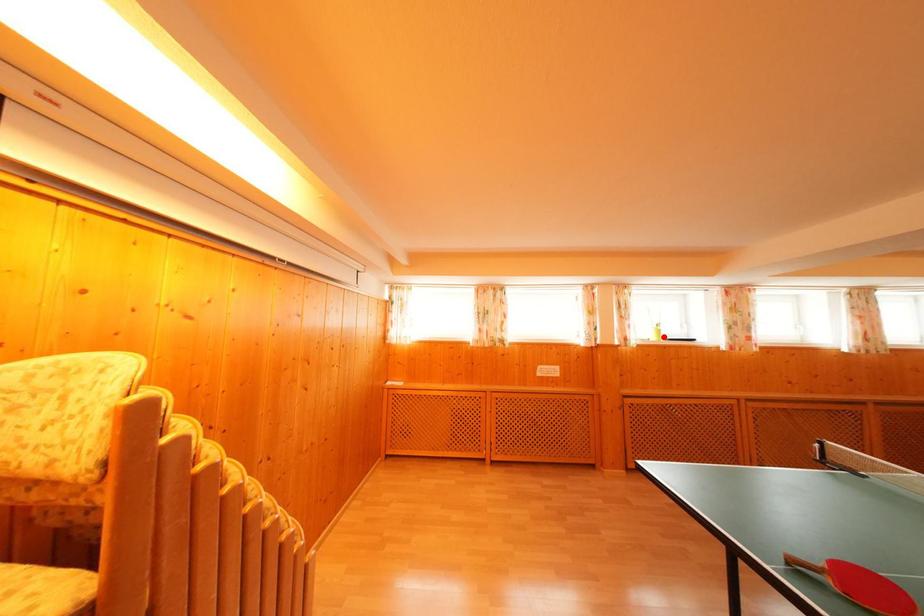
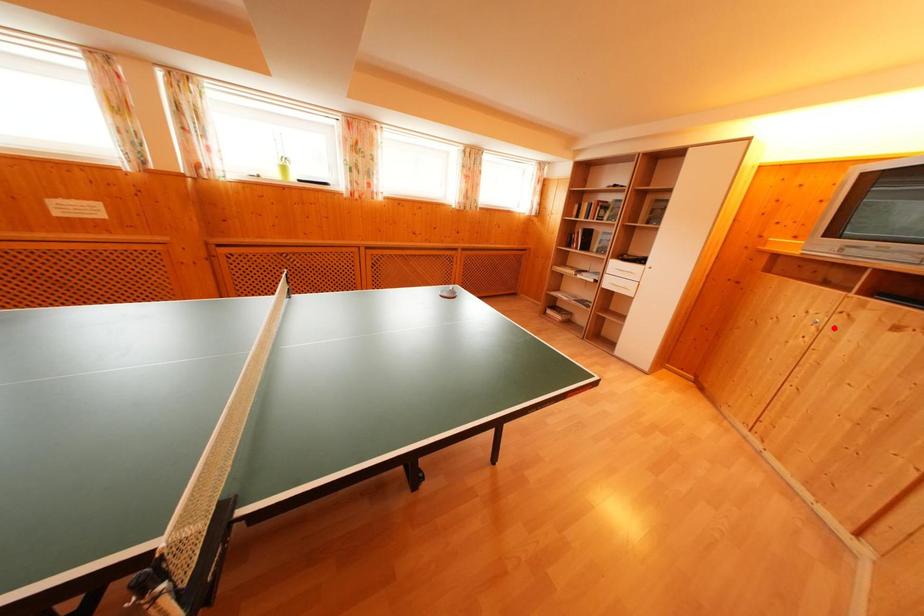
I am providing you with two images of the same scene from different viewpoints. A red point is marked on the first image and another point is marked on the second image. Is the red point in image1 aligned with the point shown in image2?

No